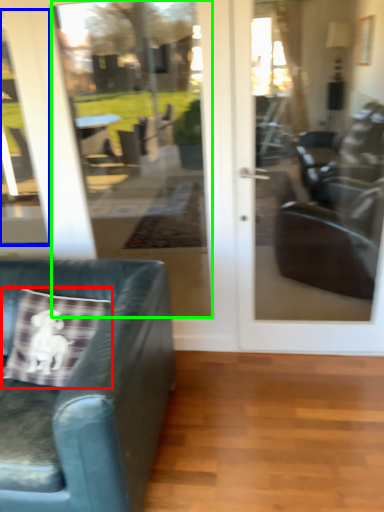
Question: Which object is the closest to the throw pillow (highlighted by a red box)? Choose among these: window (highlighted by a blue box) or glass door (highlighted by a green box).

Choices:
 (A) window
 (B) glass door

Answer: (A)